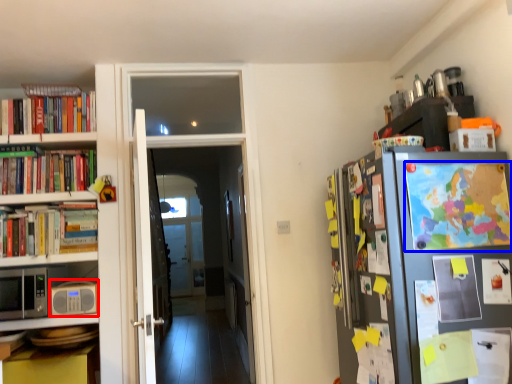
Question: Which point is further to the camera, appliance (highlighted by a red box) or book (highlighted by a blue box)?

Choices:
 (A) appliance
 (B) book

Answer: (A)